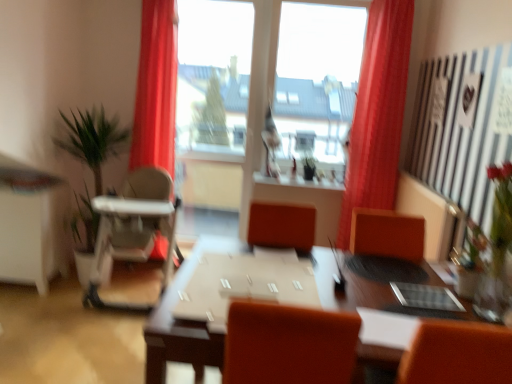
Question: Considering the relative positions of transparent glass window at center and green leafy plant at left in the image provided, is transparent glass window at center to the left or to the right of green leafy plant at left?

Choices:
 (A) left
 (B) right

Answer: (B)

Question: Looking at their shapes, would you say transparent glass window at center is wider or thinner than green leafy plant at left?

Choices:
 (A) wide
 (B) thin

Answer: (B)

Question: Which object is positioned closest to the white glossy computer desk at left?

Choices:
 (A) transparent glass window at center
 (B) transparent glass window at center
 (C) white plastic high chair at left
 (D) green leafy plant at left
 (E) matte red curtain at center

Answer: (D)

Question: Which of these objects is positioned closest to the matte red curtain at center?

Choices:
 (A) brown wooden table at center
 (B) transparent glass window at center
 (C) clear glass vase at right
 (D) transparent glass window at center
 (E) green leafy plant at left

Answer: (A)